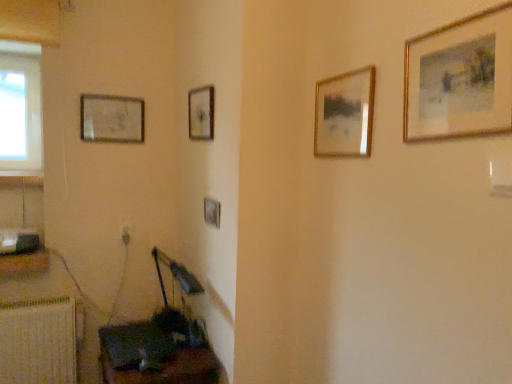
The image size is (512, 384). Describe the element at coordinates (344, 114) in the screenshot. I see `wooden frame painting at center, arranged as the 2th picture frame when viewed from the front` at that location.

This screenshot has height=384, width=512. I want to click on wooden frame painting at center, the 2th picture frame in the right-to-left sequence, so click(x=344, y=114).

Measure the distance between gold-framed painting at upper right, marked as the fifth picture frame in a left-to-right arrangement, and camera.

gold-framed painting at upper right, marked as the fifth picture frame in a left-to-right arrangement, is 88.37 centimeters away from camera.

This screenshot has width=512, height=384. In order to click on gold-framed painting at upper right, marked as the fifth picture frame in a left-to-right arrangement in this screenshot , I will do `click(487, 81)`.

Find the location of a particular element. The image size is (512, 384). wooden radiator at lower left is located at coordinates (38, 342).

The width and height of the screenshot is (512, 384). Describe the element at coordinates (38, 342) in the screenshot. I see `wooden radiator at lower left` at that location.

The width and height of the screenshot is (512, 384). I want to click on wooden frame painting at center, which is counted as the 4th picture frame, starting from the back, so click(x=344, y=114).

From a real-world perspective, who is located higher, wooden frame painting at center, arranged as the fourth picture frame when viewed from the left, or white plastic electric outlet at lower left?

wooden frame painting at center, arranged as the fourth picture frame when viewed from the left.

Between wooden frame painting at center, the 2th picture frame in the right-to-left sequence, and white plastic electric outlet at lower left, which one is positioned behind?

white plastic electric outlet at lower left is further from the camera.

Is wooden frame painting at center, arranged as the fourth picture frame when viewed from the left, at the right side of white plastic electric outlet at lower left?

Yes, wooden frame painting at center, arranged as the fourth picture frame when viewed from the left, is to the right of white plastic electric outlet at lower left.

What are the coordinates of `electric outlet behind the wooden frame painting at center, arranged as the fourth picture frame when viewed from the left` in the screenshot? It's located at (125, 234).

Who is taller, wooden radiator at lower left or wooden frame painting at center, arranged as the fourth picture frame when viewed from the left?

Standing taller between the two is wooden radiator at lower left.

Considering the sizes of objects wooden radiator at lower left and wooden frame painting at center, which is counted as the 4th picture frame, starting from the back, in the image provided, who is bigger, wooden radiator at lower left or wooden frame painting at center, which is counted as the 4th picture frame, starting from the back,?

Bigger between the two is wooden radiator at lower left.

Where is `radiator on the left of wooden frame painting at center, the 2th picture frame in the right-to-left sequence`? This screenshot has height=384, width=512. radiator on the left of wooden frame painting at center, the 2th picture frame in the right-to-left sequence is located at coordinates (38, 342).

Consider the image. From a real-world perspective, is wooden radiator at lower left on wooden frame painting at center, which is counted as the 4th picture frame, starting from the back?

No.

Is wooden frame at center, which is the second picture frame from left to right, looking in the opposite direction of wooden picture frame at upper left, the fifth picture frame in the front-to-back sequence?

No, wooden frame at center, which is the second picture frame from left to right, is not facing the opposite direction of wooden picture frame at upper left, the fifth picture frame in the front-to-back sequence.

Which object is closer to the camera taking this photo, wooden frame at center, marked as the 4th picture frame in a right-to-left arrangement, or wooden picture frame at upper left, which is the 5th picture frame from right to left?

wooden frame at center, marked as the 4th picture frame in a right-to-left arrangement, is more forward.

How distant is wooden frame at center, marked as the 4th picture frame in a right-to-left arrangement, from wooden picture frame at upper left, which is the 5th picture frame from right to left?

wooden frame at center, marked as the 4th picture frame in a right-to-left arrangement, is 18.13 inches from wooden picture frame at upper left, which is the 5th picture frame from right to left.

Can you tell me how much wooden frame at center, the fourth picture frame positioned from the front, and wooden picture frame at upper left, which is the 5th picture frame from right to left, differ in facing direction?

wooden frame at center, the fourth picture frame positioned from the front, and wooden picture frame at upper left, which is the 5th picture frame from right to left, are facing 87.3 degrees away from each other.

Considering their positions, is gold-framed painting at upper right, which is counted as the first picture frame, starting from the front, located in front of or behind wooden radiator at lower left?

gold-framed painting at upper right, which is counted as the first picture frame, starting from the front, is in front of wooden radiator at lower left.

Looking at their sizes, would you say gold-framed painting at upper right, marked as the fifth picture frame in a left-to-right arrangement, is wider or thinner than wooden radiator at lower left?

Clearly, gold-framed painting at upper right, marked as the fifth picture frame in a left-to-right arrangement, has less width compared to wooden radiator at lower left.

Based on their positions, is gold-framed painting at upper right, marked as the fifth picture frame in a left-to-right arrangement, located to the left or right of wooden radiator at lower left?

From the image, it's evident that gold-framed painting at upper right, marked as the fifth picture frame in a left-to-right arrangement, is to the right of wooden radiator at lower left.

Based on their sizes in the image, would you say gold-framed painting at upper right, the first picture frame in the right-to-left sequence, is bigger or smaller than wooden radiator at lower left?

In the image, gold-framed painting at upper right, the first picture frame in the right-to-left sequence, appears to be smaller than wooden radiator at lower left.

Does wooden frame painting at center, arranged as the 2th picture frame when viewed from the front, appear on the left side of wooden dark brown table at lower left?

Incorrect, wooden frame painting at center, arranged as the 2th picture frame when viewed from the front, is not on the left side of wooden dark brown table at lower left.

Locate an element on the screen. This screenshot has width=512, height=384. table below the wooden frame painting at center, which is counted as the 4th picture frame, starting from the back (from a real-world perspective) is located at coordinates (168, 369).

Which is in front, point (365, 105) or point (159, 376)?

The point (365, 105) is in front.

Is wooden frame painting at center, arranged as the fourth picture frame when viewed from the left, turned away from wooden dark brown table at lower left?

No, wooden dark brown table at lower left is not at the back of wooden frame painting at center, arranged as the fourth picture frame when viewed from the left.

Which picture frame is the 1st one when counting from the front of the white plastic electric outlet at lower left? Please provide its 2D coordinates.

[(111, 119)]

Can you tell me how much wooden picture frame at upper left, marked as the first picture frame in a left-to-right arrangement, and white plastic electric outlet at lower left differ in facing direction?

The angular difference between wooden picture frame at upper left, marked as the first picture frame in a left-to-right arrangement, and white plastic electric outlet at lower left is 0.995 degrees.

From the image's perspective, who appears lower, wooden picture frame at upper left, the fifth picture frame in the front-to-back sequence, or white plastic electric outlet at lower left?

white plastic electric outlet at lower left is shown below in the image.

Is wooden picture frame at upper left, which is the 5th picture frame from right to left, facing away from white plastic electric outlet at lower left?

wooden picture frame at upper left, which is the 5th picture frame from right to left, does not have its back to white plastic electric outlet at lower left.

From a real-world perspective, is wooden picture frame at lower left, the 3th picture frame positioned from the left, positioned under wooden frame at center, marked as the 4th picture frame in a right-to-left arrangement, based on gravity?

Yes.

Is wooden picture frame at lower left, the 3th picture frame positioned from the left, far away from wooden frame at center, which is the second picture frame in back-to-front order?

wooden picture frame at lower left, the 3th picture frame positioned from the left, is near wooden frame at center, which is the second picture frame in back-to-front order, not far away.

Is wooden picture frame at lower left, the 3th picture frame when ordered from right to left, bigger or smaller than wooden frame at center, which is the second picture frame in back-to-front order?

Considering their sizes, wooden picture frame at lower left, the 3th picture frame when ordered from right to left, takes up less space than wooden frame at center, which is the second picture frame in back-to-front order.

From the image's perspective, would you say wooden picture frame at lower left, acting as the 3th picture frame starting from the back, is shown under wooden frame at center, which is the second picture frame in back-to-front order?

Yes, from the image's perspective, wooden picture frame at lower left, acting as the 3th picture frame starting from the back, is beneath wooden frame at center, which is the second picture frame in back-to-front order.

The image size is (512, 384). Identify the location of electric outlet behind the wooden frame painting at center, arranged as the fourth picture frame when viewed from the left. (125, 234).

Identify the location of radiator that appears below the wooden frame painting at center, the 2th picture frame in the right-to-left sequence (from a real-world perspective). The width and height of the screenshot is (512, 384). (38, 342).

Looking at the image, which one is located closer to wooden frame painting at center, arranged as the 2th picture frame when viewed from the front, wooden picture frame at lower left, the 3th picture frame when ordered from right to left, or wooden picture frame at upper left, marked as the first picture frame in a left-to-right arrangement?

The object closer to wooden frame painting at center, arranged as the 2th picture frame when viewed from the front, is wooden picture frame at lower left, the 3th picture frame when ordered from right to left.

Estimate the real-world distances between objects in this image. Which object is further from wooden frame at center, marked as the 4th picture frame in a right-to-left arrangement, wooden picture frame at lower left, acting as the third picture frame starting from the front, or gold-framed painting at upper right, the first picture frame in the right-to-left sequence?

gold-framed painting at upper right, the first picture frame in the right-to-left sequence.

Which object lies further to the anchor point wooden picture frame at lower left, acting as the third picture frame starting from the front, wooden picture frame at upper left, the fifth picture frame in the front-to-back sequence, or wooden frame at center, the fourth picture frame positioned from the front?

wooden picture frame at upper left, the fifth picture frame in the front-to-back sequence, is further to wooden picture frame at lower left, acting as the third picture frame starting from the front.

When comparing their distances from gold-framed painting at upper right, the fifth picture frame viewed from the back, does wooden picture frame at upper left, the fifth picture frame in the front-to-back sequence, or white plastic electric outlet at lower left seem closer?

wooden picture frame at upper left, the fifth picture frame in the front-to-back sequence, lies closer to gold-framed painting at upper right, the fifth picture frame viewed from the back, than the other object.

Based on their spatial positions, is wooden frame at center, which is the second picture frame in back-to-front order, or wooden frame painting at center, arranged as the 2th picture frame when viewed from the front, further from wooden dark brown table at lower left?

Based on the image, wooden frame painting at center, arranged as the 2th picture frame when viewed from the front, appears to be further to wooden dark brown table at lower left.

Looking at the image, which one is located further to wooden frame at center, the fourth picture frame positioned from the front, wooden picture frame at upper left, which is the 5th picture frame from right to left, or gold-framed painting at upper right, the first picture frame in the right-to-left sequence?

The object further to wooden frame at center, the fourth picture frame positioned from the front, is gold-framed painting at upper right, the first picture frame in the right-to-left sequence.

When comparing their distances from wooden frame painting at center, arranged as the fourth picture frame when viewed from the left, does wooden frame at center, marked as the 4th picture frame in a right-to-left arrangement, or gold-framed painting at upper right, the first picture frame in the right-to-left sequence, seem further?

The object further to wooden frame painting at center, arranged as the fourth picture frame when viewed from the left, is wooden frame at center, marked as the 4th picture frame in a right-to-left arrangement.

Considering their positions, is wooden picture frame at upper left, which ranks as the 1th picture frame in back-to-front order, positioned further to gold-framed painting at upper right, the first picture frame in the right-to-left sequence, than wooden frame painting at center, arranged as the fourth picture frame when viewed from the left?

wooden picture frame at upper left, which ranks as the 1th picture frame in back-to-front order, is further to gold-framed painting at upper right, the first picture frame in the right-to-left sequence.

Find the location of `electric outlet between wooden radiator at lower left and gold-framed painting at upper right, the fifth picture frame viewed from the back`. electric outlet between wooden radiator at lower left and gold-framed painting at upper right, the fifth picture frame viewed from the back is located at coordinates (125, 234).

Find the location of `table located between wooden radiator at lower left and wooden picture frame at lower left, the 3th picture frame when ordered from right to left, in the left-right direction`. table located between wooden radiator at lower left and wooden picture frame at lower left, the 3th picture frame when ordered from right to left, in the left-right direction is located at coordinates (168, 369).

Locate an element on the screen. picture frame between gold-framed painting at upper right, the fifth picture frame viewed from the back, and wooden picture frame at lower left, acting as the 3th picture frame starting from the back, in the front-back direction is located at coordinates (344, 114).

I want to click on electric outlet between wooden frame painting at center, arranged as the 2th picture frame when viewed from the front, and wooden dark brown table at lower left from top to bottom, so click(x=125, y=234).